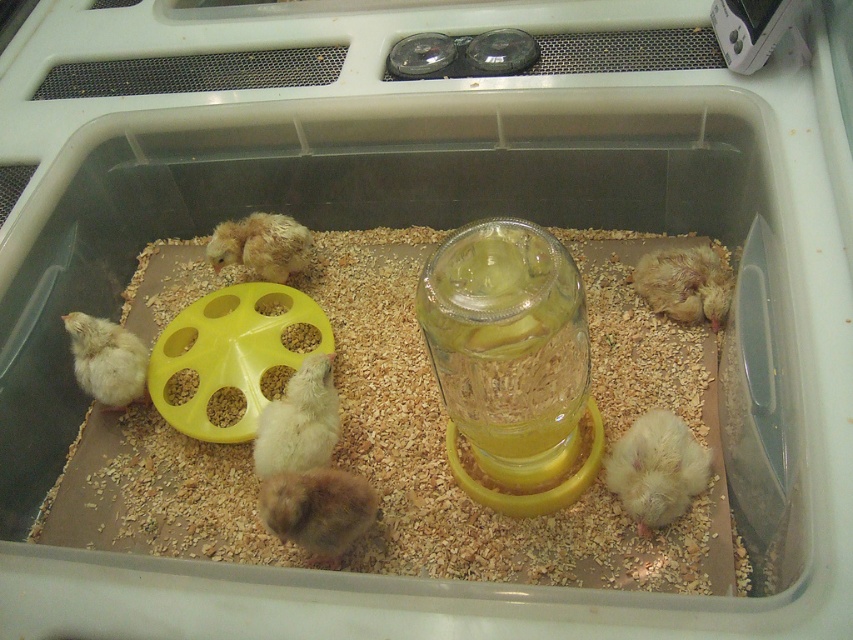
Does white fluffy hamster at lower right have a smaller size compared to brown fluffy chick at center?

→ Indeed, white fluffy hamster at lower right has a smaller size compared to brown fluffy chick at center.

Can you confirm if white fluffy hamster at lower right is positioned above brown fluffy chick at center?

Yes.

Between point (641, 476) and point (299, 484), which one is positioned behind?

Point (641, 476)

Locate an element on the screen. The height and width of the screenshot is (640, 853). white fluffy hamster at lower right is located at coordinates (656, 468).

Does point (100, 356) come closer to viewer compared to point (302, 234)?

That is True.

Locate an element on the screen. Image resolution: width=853 pixels, height=640 pixels. white fluffy chick at left is located at coordinates (106, 358).

Does white fluffy chick at center appear on the left side of light brown fluffy chick at right?

Yes, white fluffy chick at center is to the left of light brown fluffy chick at right.

Does white fluffy chick at center lie behind light brown fluffy chick at right?

No, white fluffy chick at center is in front of light brown fluffy chick at right.

The height and width of the screenshot is (640, 853). Describe the element at coordinates (299, 420) in the screenshot. I see `white fluffy chick at center` at that location.

I want to click on white fluffy chick at center, so click(x=299, y=420).